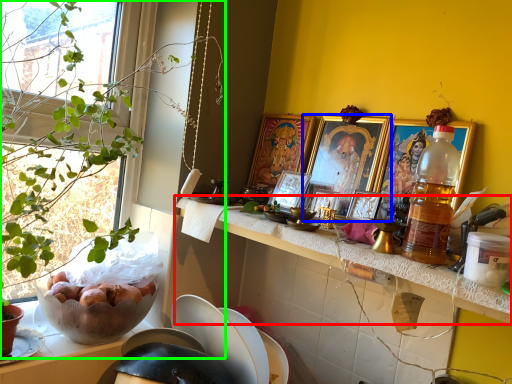
Question: Estimate the real-world distances between objects in this image. Which object is closer to countertop (highlighted by a red box), picture frame (highlighted by a blue box) or houseplant (highlighted by a green box)?

Choices:
 (A) picture frame
 (B) houseplant

Answer: (A)